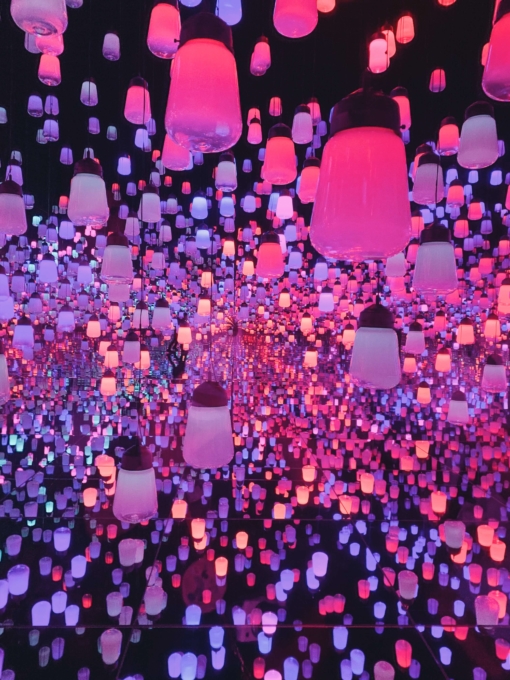
Find the location of a particular element. This screenshot has height=680, width=510. cluster of pink lights is located at coordinates (286, 345), (302, 362), (317, 426).